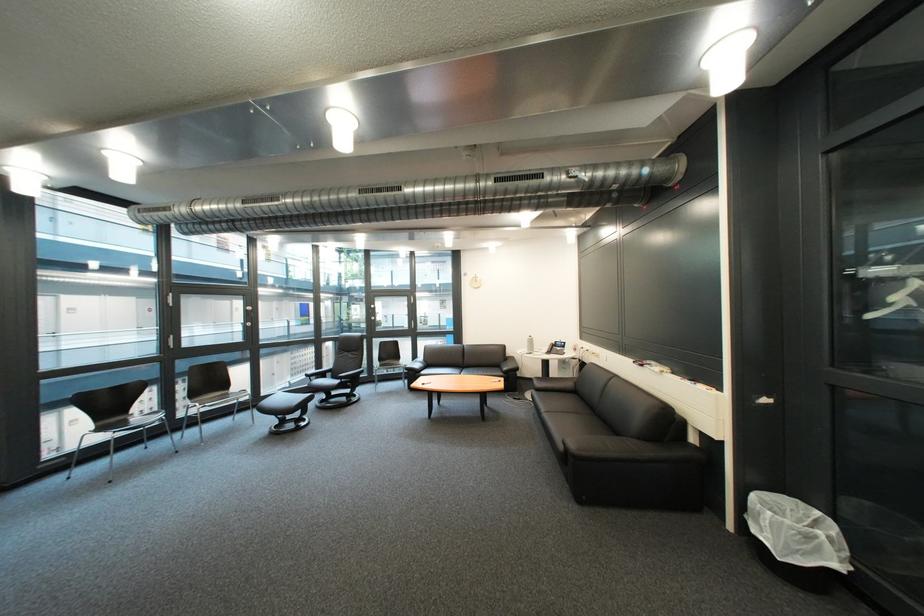
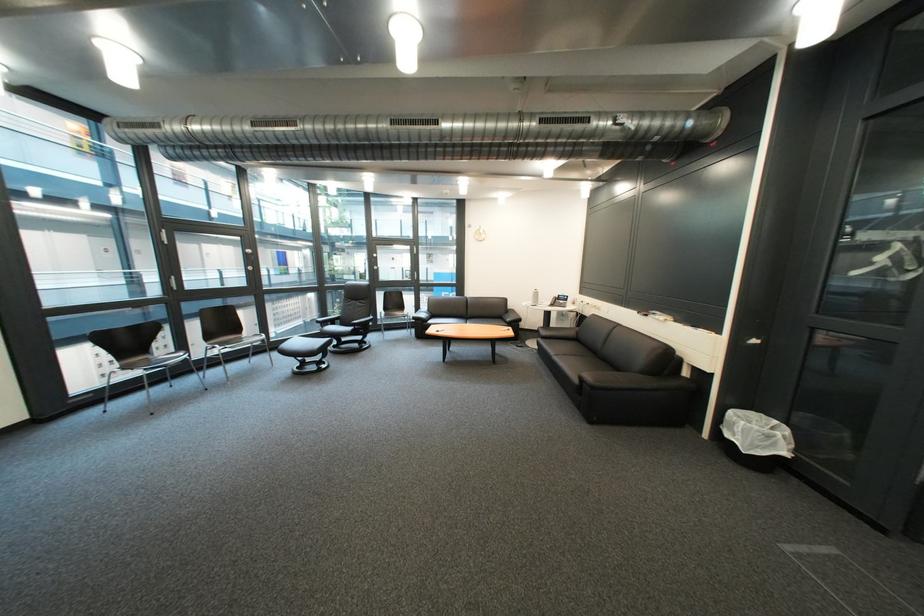
Locate, in the second image, the point that corresponds to point 438,374 in the first image.

(444, 323)